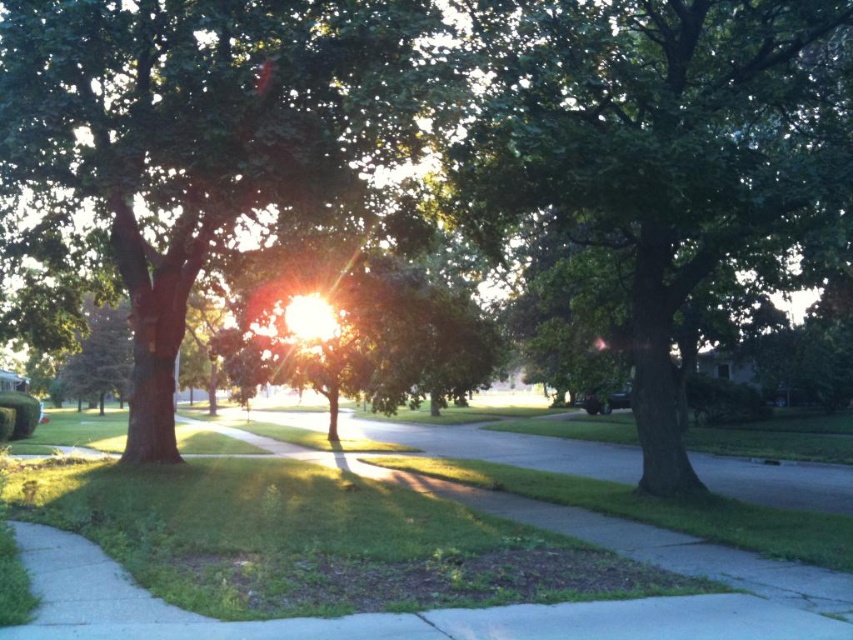
Which is below, green matte tree at center or shiny black car at center?

Positioned lower is shiny black car at center.

Measure the distance between green matte tree at center and camera.

The distance of green matte tree at center from camera is 10.60 meters.

Identify the location of green matte tree at center. (202, 132).

Which is in front, point (717, 129) or point (624, 404)?

Point (717, 129) is more forward.

Find the location of a particular element. green leafy tree at center is located at coordinates (660, 148).

Which of these two, green leafy tree at center or green matte tree at center, stands taller?

With more height is green leafy tree at center.

Between green leafy tree at center and green matte tree at center, which one appears on the right side from the viewer's perspective?

From the viewer's perspective, green leafy tree at center appears more on the right side.

Is point (589, 220) positioned after point (219, 166)?

That is True.

Image resolution: width=853 pixels, height=640 pixels. Identify the location of green leafy tree at center. (660, 148).